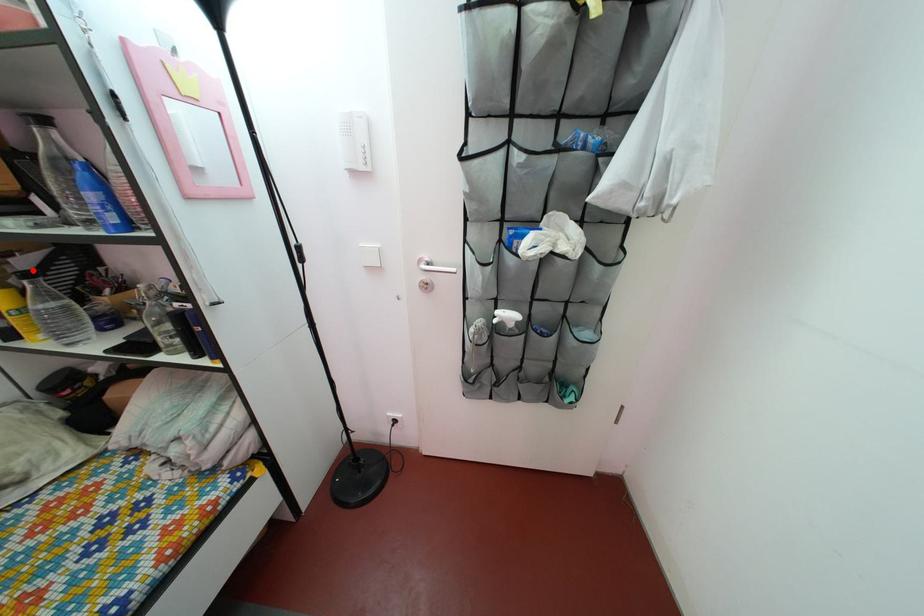
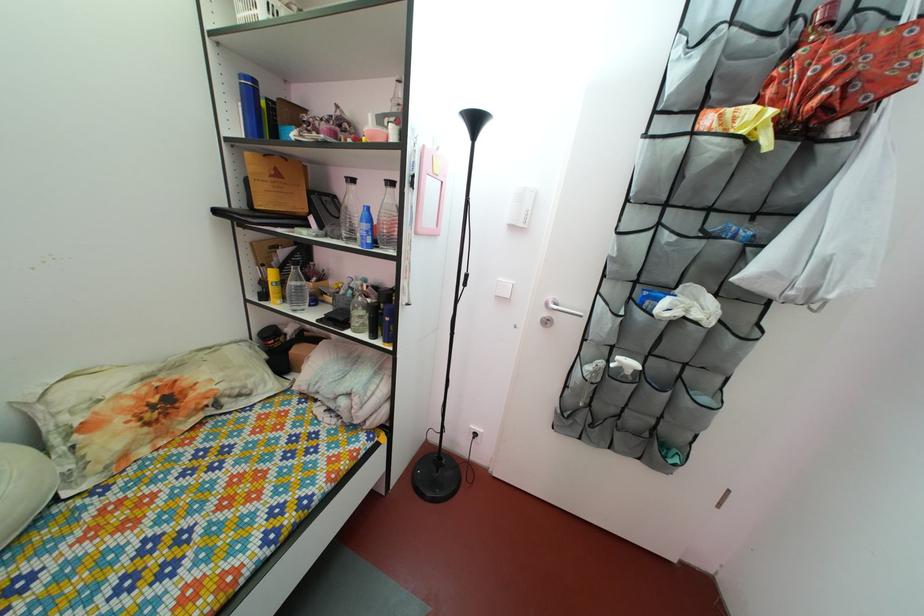
The point at the highlighted location is marked in the first image. Where is the corresponding point in the second image?

(292, 262)